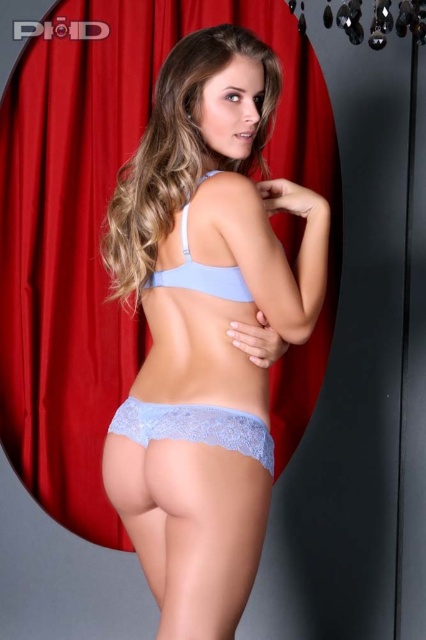
Looking at this image, who is more forward, (x=127, y=291) or (x=195, y=413)?

Positioned in front is point (x=195, y=413).

Can you confirm if light blue lace bra at center is wider than lacy blue underwear at lower center?

Indeed, light blue lace bra at center has a greater width compared to lacy blue underwear at lower center.

Identify the location of light blue lace bra at center. (178, 150).

Where is `light blue lace bra at center`? light blue lace bra at center is located at coordinates (178, 150).

Is point (189, 109) closer to camera compared to point (201, 282)?

No, (189, 109) is behind (201, 282).

Is light blue lace bra at center in front of light blue lace bikini top at center?

That is True.

Where is `light blue lace bra at center`? This screenshot has width=426, height=640. light blue lace bra at center is located at coordinates (178, 150).

Can you confirm if lacy blue underwear at lower center is positioned to the right of light blue lace bikini top at center?

Incorrect, lacy blue underwear at lower center is not on the right side of light blue lace bikini top at center.

This screenshot has height=640, width=426. Describe the element at coordinates (195, 428) in the screenshot. I see `lacy blue underwear at lower center` at that location.

The width and height of the screenshot is (426, 640). I want to click on lacy blue underwear at lower center, so click(195, 428).

Where is `lacy blue underwear at lower center`? The width and height of the screenshot is (426, 640). lacy blue underwear at lower center is located at coordinates (195, 428).